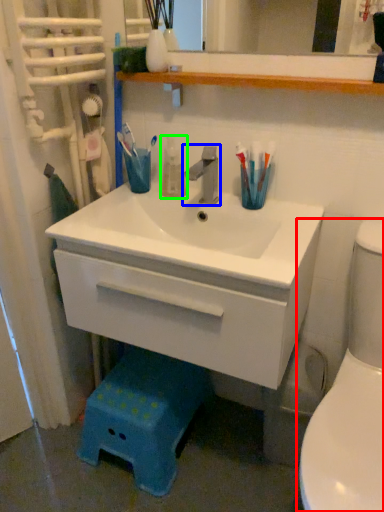
Question: Estimate the real-world distances between objects in this image. Which object is farther from toilet (highlighted by a red box), tap (highlighted by a blue box) or mouthwash (highlighted by a green box)?

Choices:
 (A) tap
 (B) mouthwash

Answer: (B)